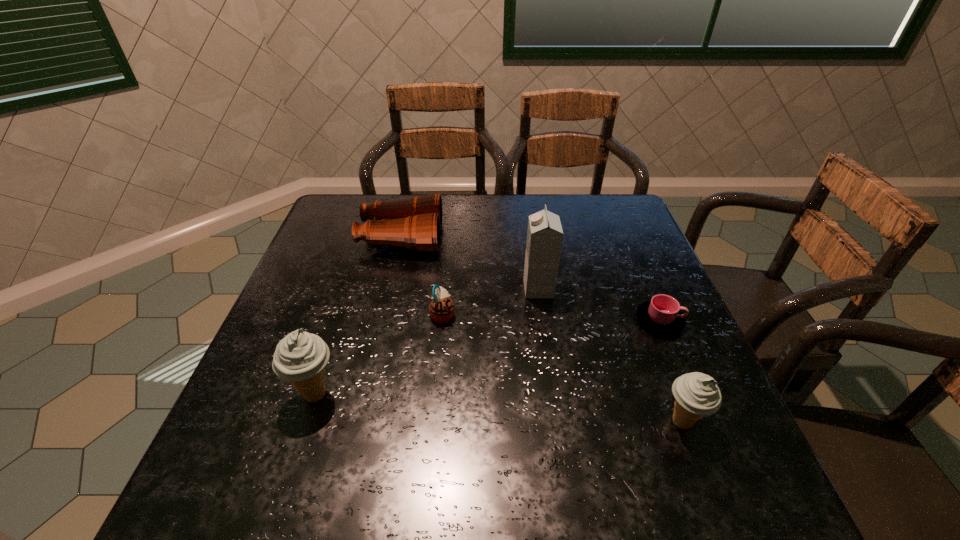
At what (x,y) coordinates should I click in order to perform the action: click on empty space between the tallest object and the fourth shortest object. Please return your answer as a coordinate pair (x, y). Looking at the image, I should click on (611, 356).

Image resolution: width=960 pixels, height=540 pixels. I want to click on object that is the closest to the fourth shortest object, so (x=662, y=315).

At what (x,y) coordinates should I click in order to perform the action: click on the fifth closest object to the tallest object. Please return your answer as a coordinate pair (x, y). Image resolution: width=960 pixels, height=540 pixels. Looking at the image, I should click on (300, 358).

At what (x,y) coordinates should I click in order to perform the action: click on free space that satisfies the following two spatial constraints: 1. through the lenses of the farthest object; 2. on the front side of the taller icecream. Please return your answer as a coordinate pair (x, y). The height and width of the screenshot is (540, 960). Looking at the image, I should click on (366, 394).